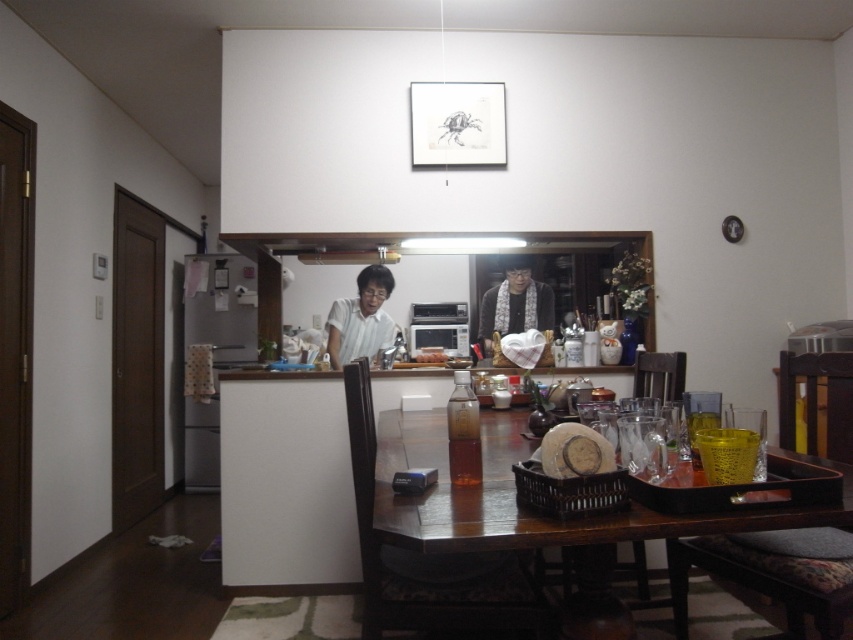
Can you confirm if brown wooden chair at center is shorter than white matte shirt at center?

In fact, brown wooden chair at center may be taller than white matte shirt at center.

Does brown wooden chair at center appear on the right side of white matte shirt at center?

Correct, you'll find brown wooden chair at center to the right of white matte shirt at center.

Image resolution: width=853 pixels, height=640 pixels. What do you see at coordinates (434, 561) in the screenshot? I see `brown wooden chair at center` at bounding box center [434, 561].

This screenshot has height=640, width=853. Identify the location of brown wooden chair at center. (434, 561).

Is white textured scarf at center smaller than brown matte bread at center?

Actually, white textured scarf at center might be larger than brown matte bread at center.

Is white textured scarf at center below brown matte bread at center?

Incorrect, white textured scarf at center is not positioned below brown matte bread at center.

Who is more distant from viewer, (x=486, y=305) or (x=428, y=349)?

The point (x=428, y=349) is behind.

Where is `white textured scarf at center`? The image size is (853, 640). white textured scarf at center is located at coordinates (515, 304).

Is brown wooden chair at center thinner than brown matte bread at center?

In fact, brown wooden chair at center might be wider than brown matte bread at center.

Between brown wooden chair at center and brown matte bread at center, which one appears on the left side from the viewer's perspective?

Positioned to the left is brown matte bread at center.

The image size is (853, 640). In order to click on brown wooden chair at center in this screenshot , I will do `click(434, 561)`.